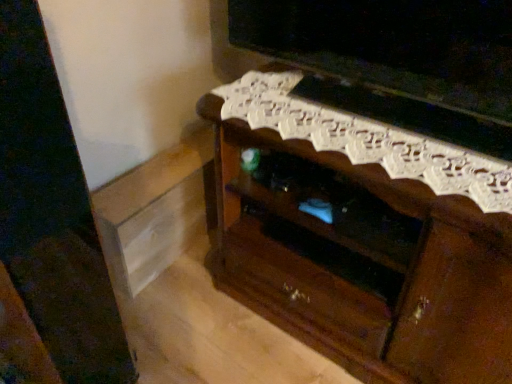
What do you see at coordinates (362, 238) in the screenshot? The width and height of the screenshot is (512, 384). I see `brown wood cabinet at center` at bounding box center [362, 238].

In order to face brown wood cabinet at center, should I rotate leftwards or rightwards?

Rotate right and turn 16.782 degrees.

Where is `brown wood cabinet at center`? The width and height of the screenshot is (512, 384). brown wood cabinet at center is located at coordinates (362, 238).

Locate an element on the screen. This screenshot has height=384, width=512. brown wood cabinet at center is located at coordinates (362, 238).